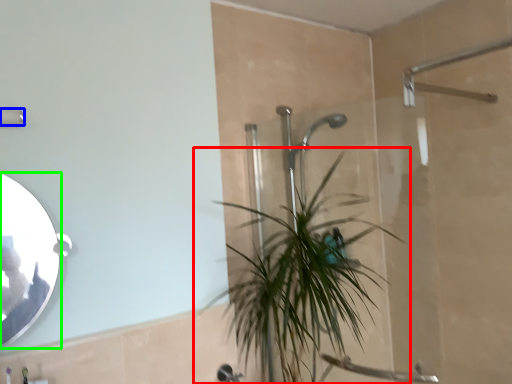
Question: Which object is the farthest from houseplant (highlighted by a red box)? Choose among these: shower (highlighted by a blue box) or mirror (highlighted by a green box).

Choices:
 (A) shower
 (B) mirror

Answer: (A)